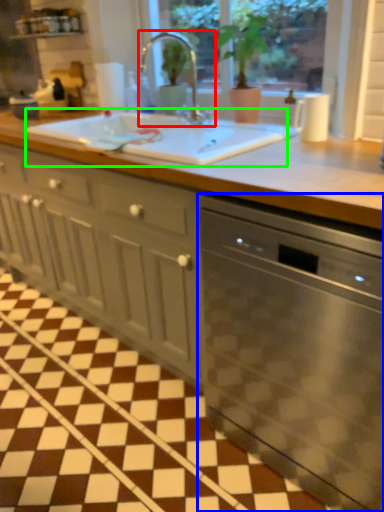
Question: Which object is positioned closest to tap (highlighted by a red box)? Select from home appliance (highlighted by a blue box) and sink (highlighted by a green box).

Choices:
 (A) home appliance
 (B) sink

Answer: (B)